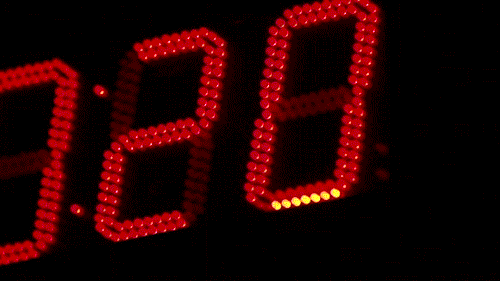
Find the location of `blue text "from" written on whiteboard`. blue text "from" written on whiteboard is located at coordinates (172, 82).